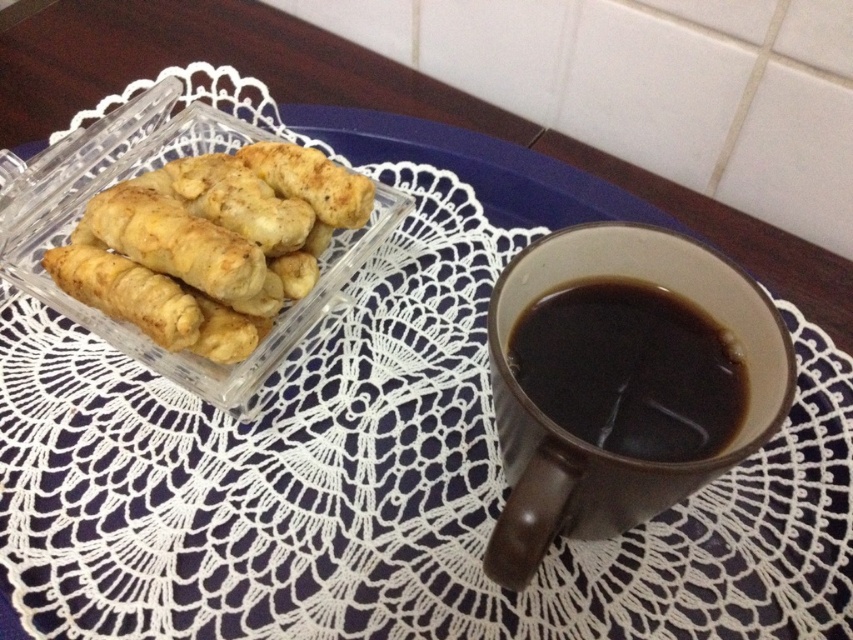
Does point (763, 342) come farther from viewer compared to point (164, 300)?

No, it is not.

Can you confirm if brown ceramic mug at right is wider than golden crispy pastry at left?

No.

Image resolution: width=853 pixels, height=640 pixels. I want to click on brown ceramic mug at right, so click(x=589, y=444).

I want to click on brown ceramic mug at right, so click(x=589, y=444).

Who is lower down, golden crispy pastry at left or black matte mug at right?

black matte mug at right

Does golden crispy pastry at left appear under black matte mug at right?

Actually, golden crispy pastry at left is above black matte mug at right.

Does point (234, 321) come closer to viewer compared to point (607, 346)?

No, (234, 321) is further to viewer.

The image size is (853, 640). In order to click on golden crispy pastry at left in this screenshot , I will do `click(210, 243)`.

Can you confirm if brown ceramic mug at right is positioned to the right of black matte mug at right?

Incorrect, brown ceramic mug at right is not on the right side of black matte mug at right.

Who is more forward, (x=527, y=552) or (x=708, y=456)?

Point (x=527, y=552) is more forward.

You are a GUI agent. You are given a task and a screenshot of the screen. Output one action in this format:
    pyautogui.click(x=<x>, y=<y>)
    Task: Click on the brown ceramic mug at right
    Image resolution: width=853 pixels, height=640 pixels.
    Given the screenshot: What is the action you would take?
    pyautogui.click(x=589, y=444)